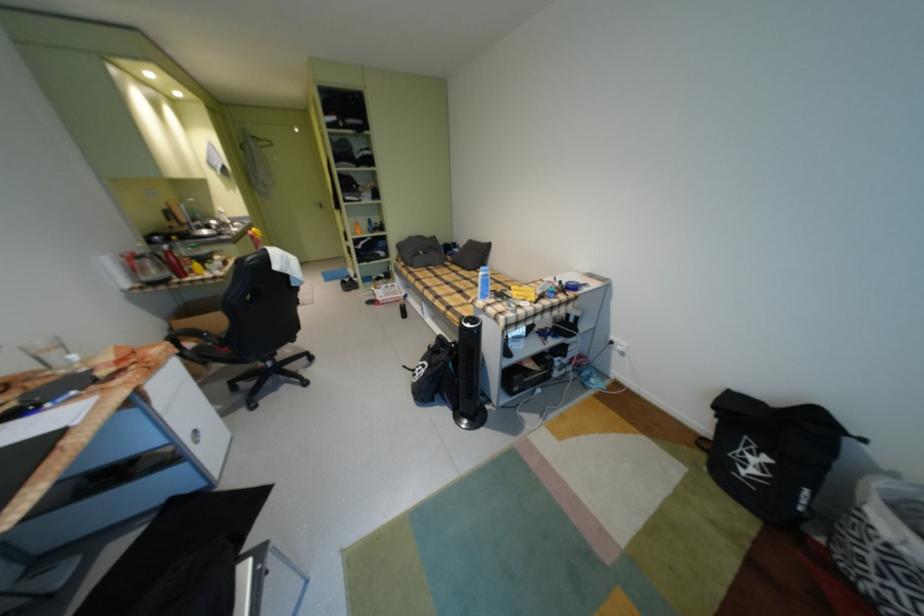
Image resolution: width=924 pixels, height=616 pixels. I want to click on faucet handle, so click(x=224, y=217).